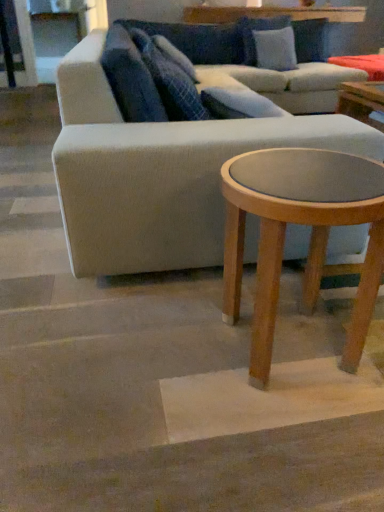
Locate an element on the screen. This screenshot has height=512, width=384. vacant space in front of light brown wood coffee table at lower right is located at coordinates (278, 445).